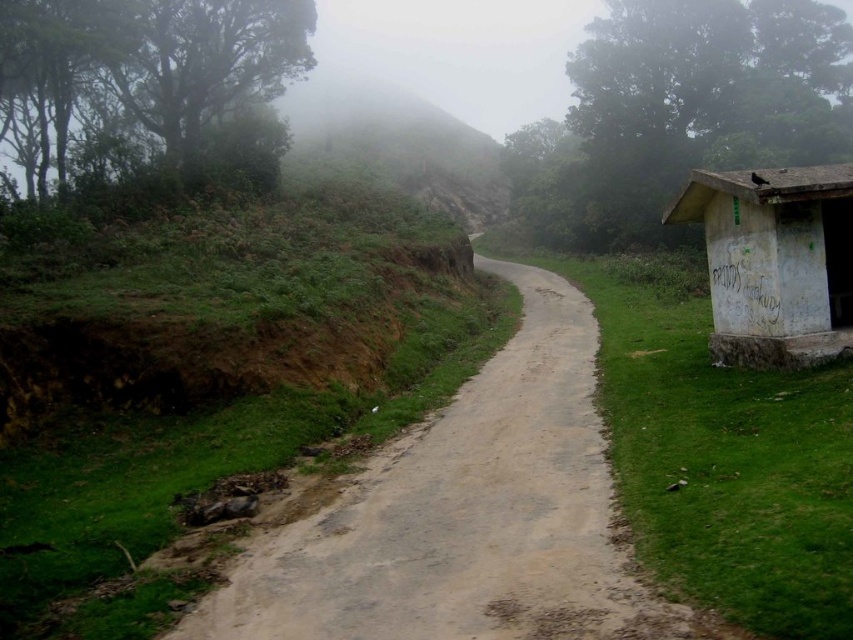
Question: Is dull gray concrete path at center to the left of white concrete hut at right from the viewer's perspective?

Choices:
 (A) no
 (B) yes

Answer: (B)

Question: Is dull gray concrete path at center further to the viewer compared to white concrete hut at right?

Choices:
 (A) yes
 (B) no

Answer: (B)

Question: Does dull gray concrete path at center come in front of white concrete hut at right?

Choices:
 (A) no
 (B) yes

Answer: (B)

Question: Which of the following is the farthest from the observer?

Choices:
 (A) dull gray concrete path at center
 (B) white concrete hut at right

Answer: (B)